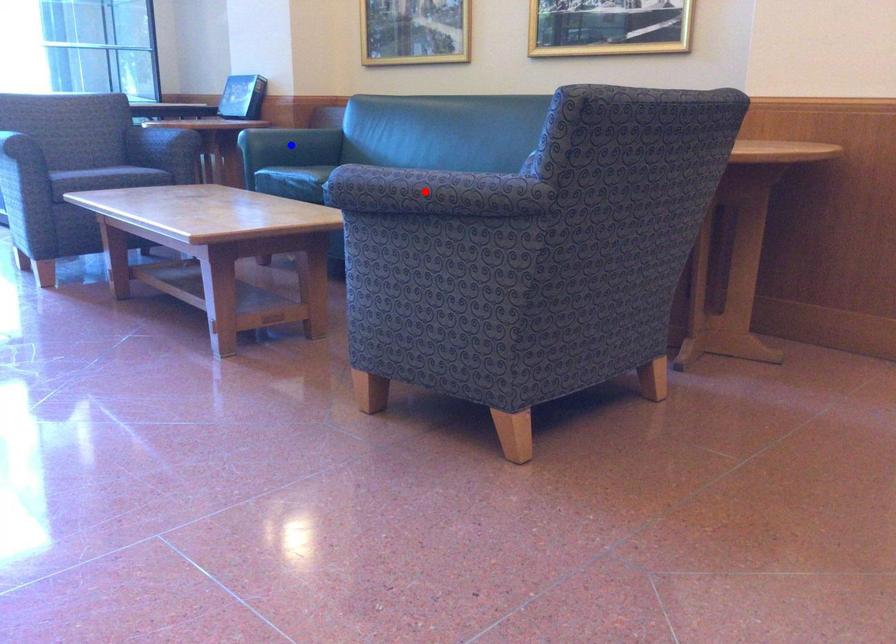
Question: Two points are marked on the image. Which point is closer to the camera?

Choices:
 (A) Blue point is closer.
 (B) Red point is closer.

Answer: (B)